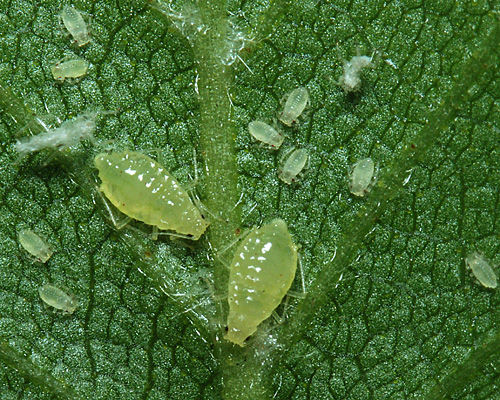
The height and width of the screenshot is (400, 500). What are the coordinates of `right front leg` in the screenshot? It's located at (278, 319), (154, 238).